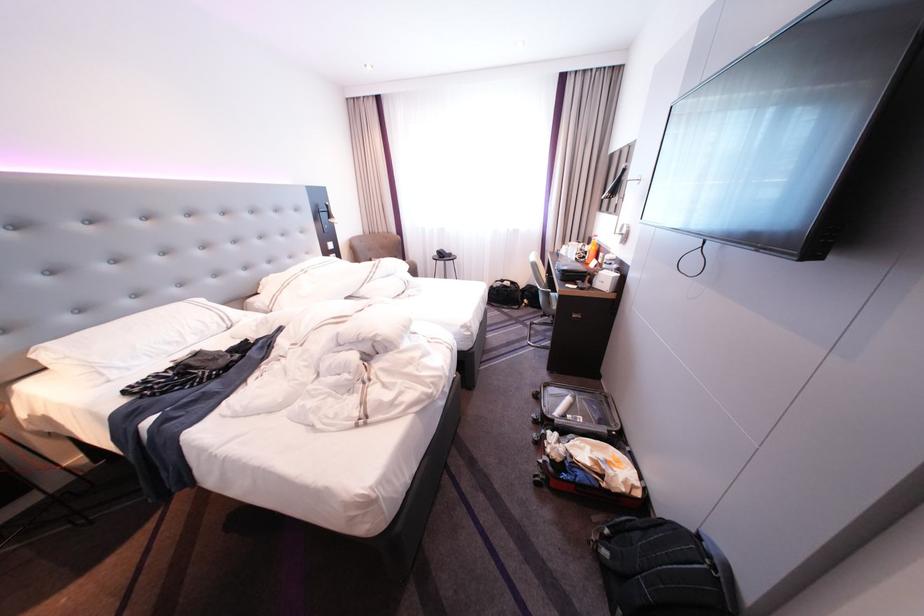
Describe the element at coordinates (397, 265) in the screenshot. This screenshot has width=924, height=616. I see `the brown chair sitting surface` at that location.